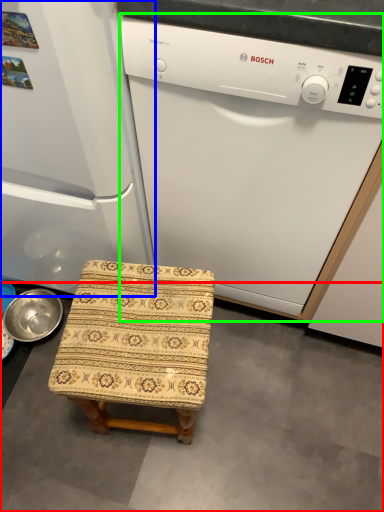
Question: Estimate the real-world distances between objects in this image. Which object is closer to concrete (highlighted by a red box), refrigerator (highlighted by a blue box) or home appliance (highlighted by a green box)?

Choices:
 (A) refrigerator
 (B) home appliance

Answer: (B)